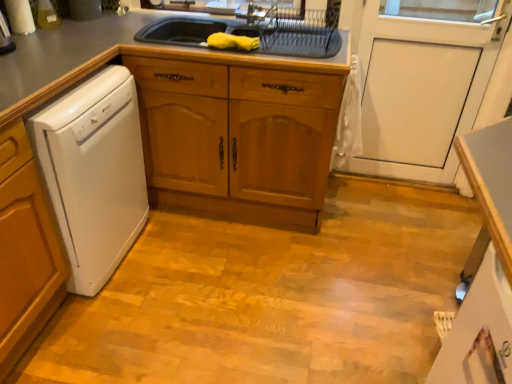
In order to click on free space that is in between gray matte countertop at upper center and white glossy counter at lower right in this screenshot , I will do `click(287, 273)`.